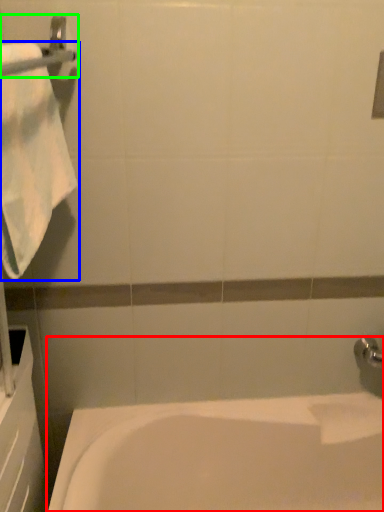
Question: Estimate the real-world distances between objects in this image. Which object is farther from bathtub (highlighted by a red box), towel (highlighted by a blue box) or towel bar (highlighted by a green box)?

Choices:
 (A) towel
 (B) towel bar

Answer: (B)